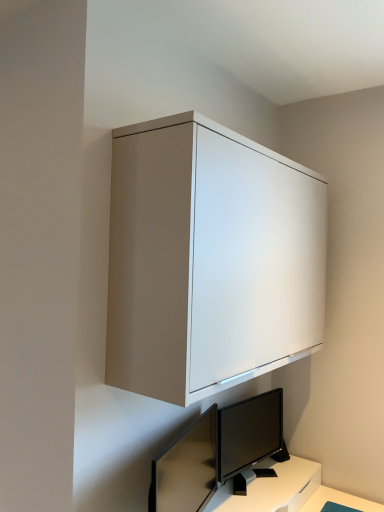
Where is `matte black monitor at lower center, the 1th computer monitor positioned from the front`? matte black monitor at lower center, the 1th computer monitor positioned from the front is located at coordinates (186, 468).

Looking at this image, in order to face matte black monitor at lower center, which is the first computer monitor in left-to-right order, should I rotate leftwards or rightwards?

Turn left by 0.683 degrees to look at matte black monitor at lower center, which is the first computer monitor in left-to-right order.

The height and width of the screenshot is (512, 384). Describe the element at coordinates (209, 259) in the screenshot. I see `matte white cabinet at upper center` at that location.

Where is `matte black monitor at lower center, which is the second computer monitor in back-to-front order`? matte black monitor at lower center, which is the second computer monitor in back-to-front order is located at coordinates (186, 468).

Which of these two, black glossy monitor at lower center, which is the 2th computer monitor in front-to-back order, or matte black monitor at lower center, the 1th computer monitor positioned from the front, is thinner?

Thinner between the two is black glossy monitor at lower center, which is the 2th computer monitor in front-to-back order.

How different are the orientations of black glossy monitor at lower center, the first computer monitor from the right, and matte black monitor at lower center, which is the 2th computer monitor from right to left, in degrees?

The angular difference between black glossy monitor at lower center, the first computer monitor from the right, and matte black monitor at lower center, which is the 2th computer monitor from right to left, is 26.3 degrees.

From a real-world perspective, which object rests below the other?

black glossy monitor at lower center, which is the 2th computer monitor in front-to-back order, from a real-world perspective.

Which is behind, point (277, 424) or point (192, 477)?

The point (277, 424) is farther from the camera.

From the picture: Is matte white cabinet at upper center taller than black glossy monitor at lower center, which is the 2th computer monitor in front-to-back order?

Yes.

Is matte white cabinet at upper center placed right next to black glossy monitor at lower center, which is the 1th computer monitor from back to front?

matte white cabinet at upper center and black glossy monitor at lower center, which is the 1th computer monitor from back to front, are clearly separated.

Considering the sizes of objects matte white cabinet at upper center and black glossy monitor at lower center, which is the second computer monitor in left-to-right order, in the image provided, who is bigger, matte white cabinet at upper center or black glossy monitor at lower center, which is the second computer monitor in left-to-right order,?

matte white cabinet at upper center is bigger.

The image size is (384, 512). In order to click on cabinetry that is above the black glossy monitor at lower center, which is the second computer monitor in left-to-right order (from the image's perspective) in this screenshot , I will do `click(209, 259)`.

From the image's perspective, who appears lower, matte black monitor at lower center, which is the 2th computer monitor from right to left, or matte white cabinet at upper center?

matte black monitor at lower center, which is the 2th computer monitor from right to left, from the image's perspective.

Does matte black monitor at lower center, which is the first computer monitor in left-to-right order, have a greater height compared to matte white cabinet at upper center?

No, matte black monitor at lower center, which is the first computer monitor in left-to-right order, is not taller than matte white cabinet at upper center.

Is matte black monitor at lower center, which is the 2th computer monitor from right to left, beside matte white cabinet at upper center?

There is a gap between matte black monitor at lower center, which is the 2th computer monitor from right to left, and matte white cabinet at upper center.

Is matte white cabinet at upper center surrounded by black glossy monitor at lower center, the first computer monitor from the right?

No, matte white cabinet at upper center is not surrounded by black glossy monitor at lower center, the first computer monitor from the right.

Could you tell me if black glossy monitor at lower center, which is the 2th computer monitor in front-to-back order, is turned towards matte white cabinet at upper center?

No, black glossy monitor at lower center, which is the 2th computer monitor in front-to-back order, is not aimed at matte white cabinet at upper center.

Is black glossy monitor at lower center, which is the 1th computer monitor from back to front, not close to matte white cabinet at upper center?

No, black glossy monitor at lower center, which is the 1th computer monitor from back to front, is not far from matte white cabinet at upper center.

Considering the relative sizes of black glossy monitor at lower center, which is the 1th computer monitor from back to front, and matte white cabinet at upper center in the image provided, is black glossy monitor at lower center, which is the 1th computer monitor from back to front, bigger than matte white cabinet at upper center?

No.

What's the angular difference between matte black monitor at lower center, which is the first computer monitor in left-to-right order, and black glossy monitor at lower center, which is the second computer monitor in left-to-right order,'s facing directions?

The facing directions of matte black monitor at lower center, which is the first computer monitor in left-to-right order, and black glossy monitor at lower center, which is the second computer monitor in left-to-right order, are 26.3 degrees apart.

Considering the sizes of objects matte black monitor at lower center, the 1th computer monitor positioned from the front, and black glossy monitor at lower center, which is the second computer monitor in left-to-right order, in the image provided, who is thinner, matte black monitor at lower center, the 1th computer monitor positioned from the front, or black glossy monitor at lower center, which is the second computer monitor in left-to-right order,?

With smaller width is black glossy monitor at lower center, which is the second computer monitor in left-to-right order.

Based on their positions, is matte black monitor at lower center, which is the 2th computer monitor from right to left, located to the left or right of black glossy monitor at lower center, which is the 1th computer monitor from back to front?

Based on their positions, matte black monitor at lower center, which is the 2th computer monitor from right to left, is located to the left of black glossy monitor at lower center, which is the 1th computer monitor from back to front.

From the picture: Between matte black monitor at lower center, which is the second computer monitor in back-to-front order, and black glossy monitor at lower center, the first computer monitor from the right, which one has smaller size?

With smaller size is black glossy monitor at lower center, the first computer monitor from the right.

Could you tell me if matte white cabinet at upper center is facing matte black monitor at lower center, which is the first computer monitor in left-to-right order?

No, matte white cabinet at upper center is not oriented towards matte black monitor at lower center, which is the first computer monitor in left-to-right order.

Considering the sizes of objects matte white cabinet at upper center and matte black monitor at lower center, the 1th computer monitor positioned from the front, in the image provided, who is taller, matte white cabinet at upper center or matte black monitor at lower center, the 1th computer monitor positioned from the front,?

Standing taller between the two is matte white cabinet at upper center.

Find the location of a particular element. the 1st computer monitor behind the matte white cabinet at upper center is located at coordinates click(186, 468).

Is point (133, 237) closer to camera compared to point (217, 457)?

That is True.

Where is `computer monitor above the black glossy monitor at lower center, which is the 2th computer monitor in front-to-back order (from the image's perspective)`? This screenshot has width=384, height=512. computer monitor above the black glossy monitor at lower center, which is the 2th computer monitor in front-to-back order (from the image's perspective) is located at coordinates [x=186, y=468].

Where is `the 2nd computer monitor behind the matte white cabinet at upper center`? the 2nd computer monitor behind the matte white cabinet at upper center is located at coordinates (250, 433).

Considering their positions, is matte white cabinet at upper center positioned closer to black glossy monitor at lower center, which is the second computer monitor in left-to-right order, than matte black monitor at lower center, which is the first computer monitor in left-to-right order?

Based on the image, matte black monitor at lower center, which is the first computer monitor in left-to-right order, appears to be nearer to black glossy monitor at lower center, which is the second computer monitor in left-to-right order.

Which object lies nearer to the anchor point matte white cabinet at upper center, matte black monitor at lower center, which is the 2th computer monitor from right to left, or black glossy monitor at lower center, which is the 1th computer monitor from back to front?

black glossy monitor at lower center, which is the 1th computer monitor from back to front, lies closer to matte white cabinet at upper center than the other object.

Consider the image. Looking at the image, which one is located closer to matte black monitor at lower center, which is the second computer monitor in back-to-front order, matte white cabinet at upper center or black glossy monitor at lower center, which is the second computer monitor in left-to-right order?

Based on the image, black glossy monitor at lower center, which is the second computer monitor in left-to-right order, appears to be nearer to matte black monitor at lower center, which is the second computer monitor in back-to-front order.

Based on their spatial positions, is matte black monitor at lower center, the 1th computer monitor positioned from the front, or matte white cabinet at upper center closer to black glossy monitor at lower center, the first computer monitor from the right?

matte black monitor at lower center, the 1th computer monitor positioned from the front, lies closer to black glossy monitor at lower center, the first computer monitor from the right, than the other object.

Looking at the image, which one is located closer to matte black monitor at lower center, which is the first computer monitor in left-to-right order, black glossy monitor at lower center, which is the second computer monitor in left-to-right order, or matte white cabinet at upper center?

Among the two, black glossy monitor at lower center, which is the second computer monitor in left-to-right order, is located nearer to matte black monitor at lower center, which is the first computer monitor in left-to-right order.

Considering their positions, is black glossy monitor at lower center, which is the second computer monitor in left-to-right order, positioned further to matte white cabinet at upper center than matte black monitor at lower center, which is the first computer monitor in left-to-right order?

Among the two, matte black monitor at lower center, which is the first computer monitor in left-to-right order, is located further to matte white cabinet at upper center.

Image resolution: width=384 pixels, height=512 pixels. I want to click on computer monitor between matte white cabinet at upper center and black glossy monitor at lower center, the first computer monitor from the right, in the up-down direction, so click(186, 468).